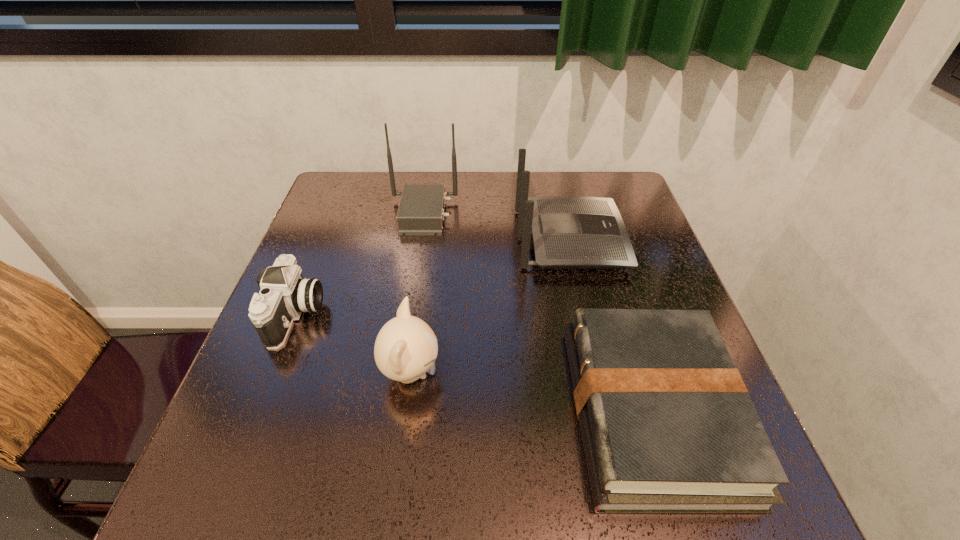
Identify the location of the left router. (421, 210).

Where is `the right router`? Image resolution: width=960 pixels, height=540 pixels. the right router is located at coordinates (569, 232).

You are a GUI agent. You are given a task and a screenshot of the screen. Output one action in this format:
    pyautogui.click(x=<x>, y=<y>)
    Task: Click on the kitten
    Image resolution: width=960 pixels, height=540 pixels.
    Given the screenshot: What is the action you would take?
    pyautogui.click(x=406, y=348)

Locate an element on the screen. The image size is (960, 540). the fourth tallest object is located at coordinates (285, 294).

You are a GUI agent. You are given a task and a screenshot of the screen. Output one action in this format:
    pyautogui.click(x=<x>, y=<y>)
    Task: Click on the camera
    The image size is (960, 540).
    Given the screenshot: What is the action you would take?
    tap(285, 294)

Locate an element on the screen. the shortest object is located at coordinates (667, 425).

I want to click on vacant space located 0.330m on the back of the left router to connect cables, so click(x=576, y=214).

Where is `blank area located 0.330m on the face of the kitten`? The image size is (960, 540). blank area located 0.330m on the face of the kitten is located at coordinates (612, 373).

Where is `vacant region located 0.090m on the back of the camera`? This screenshot has height=540, width=960. vacant region located 0.090m on the back of the camera is located at coordinates (319, 258).

At what (x,y) coordinates should I click in order to perform the action: click on blank space located on the spine side of the shortest object. Please return your answer as a coordinate pair (x, y). This screenshot has height=540, width=960. Looking at the image, I should click on (418, 411).